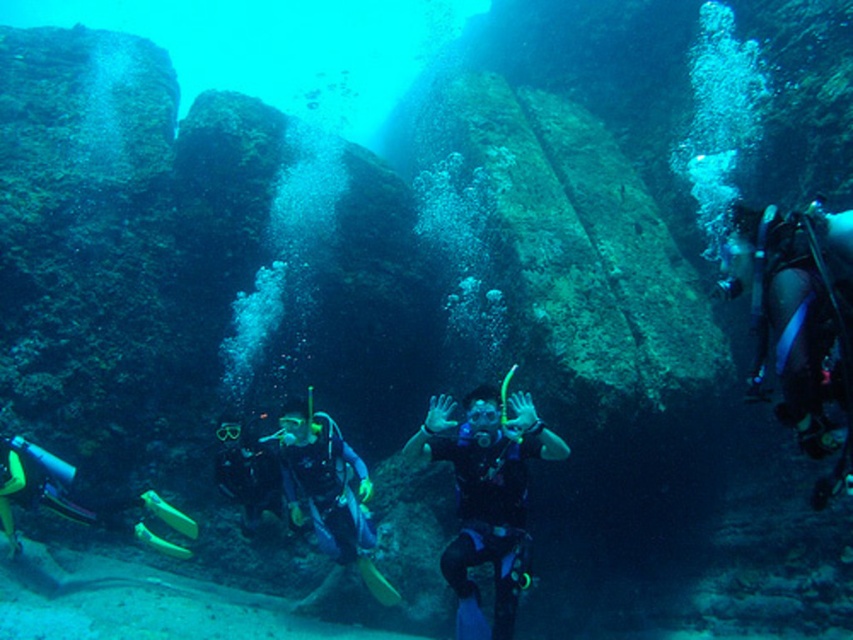
Question: Which point appears farthest from the camera in this image?

Choices:
 (A) (830, 333)
 (B) (242, 467)
 (C) (494, 420)
 (D) (326, 552)

Answer: (B)

Question: Does black matte scuba diver at center have a smaller size compared to matte black scuba diver at right?

Choices:
 (A) no
 (B) yes

Answer: (A)

Question: Is black matte scuba diver at center thinner than blue matte scuba diver at center?

Choices:
 (A) no
 (B) yes

Answer: (A)

Question: Which point is closer to the camera?

Choices:
 (A) black matte scuba diver at center
 (B) blue matte scuba diver at center
 (C) black rubber diving suit at center
 (D) matte black scuba diver at right

Answer: (D)

Question: Which of the following is the farthest from the observer?

Choices:
 (A) (747, 260)
 (B) (279, 449)
 (C) (225, 435)
 (D) (457, 452)

Answer: (B)

Question: Is blue matte scuba diver at center wider than black rubber diving suit at center?

Choices:
 (A) no
 (B) yes

Answer: (B)